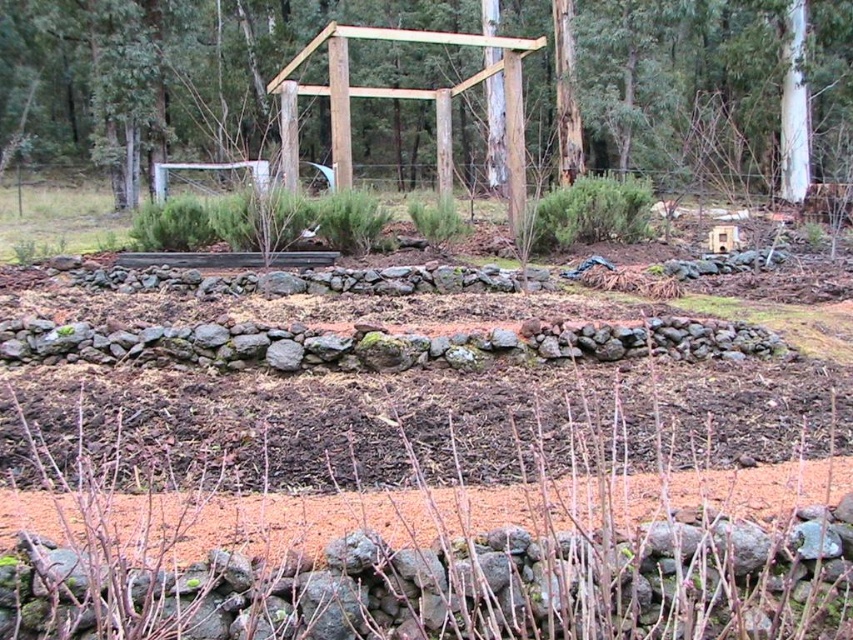
You are planning to plant a row of flowers along the right edge of the brown soil at center. Considering the placement of the brown wooden structure at center, which is to the left of the soil, will the structure block sunlight from reaching the flowers if planted there?

The brown wooden structure at center is positioned on the left side of the brown soil at center. Since the structure is to the left of the soil, it may cast a shadow on the left side of the soil but would not block sunlight from the right edge where you plan to plant the flowers.

You are a gardener planning to plant a row of flowers along the brown soil at center. The brown wooden structure at center is in the way. Can you move the structure to make space for the flowers?

The brown wooden structure at center might be wider than brown soil at center, so it may not be possible to move it without affecting the available space for planting the flowers.